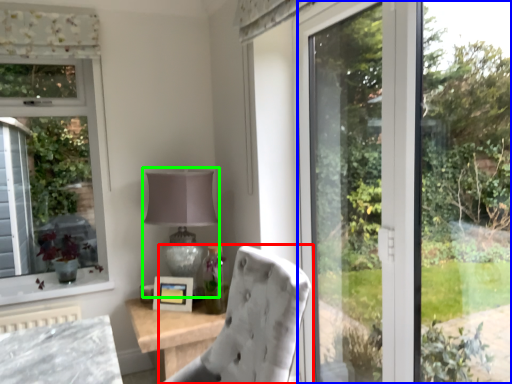
Question: Considering the real-world distances, which object is farthest from chair (highlighted by a red box)? glass door (highlighted by a blue box) or table lamp (highlighted by a green box)?

Choices:
 (A) glass door
 (B) table lamp

Answer: (B)